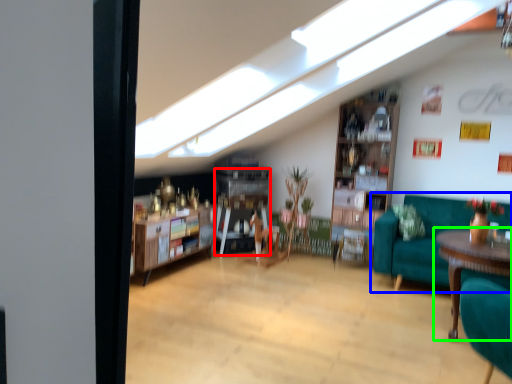
Question: Which is farther away from shelf (highlighted by a red box)? studio couch (highlighted by a blue box) or table (highlighted by a green box)?

Choices:
 (A) studio couch
 (B) table

Answer: (B)